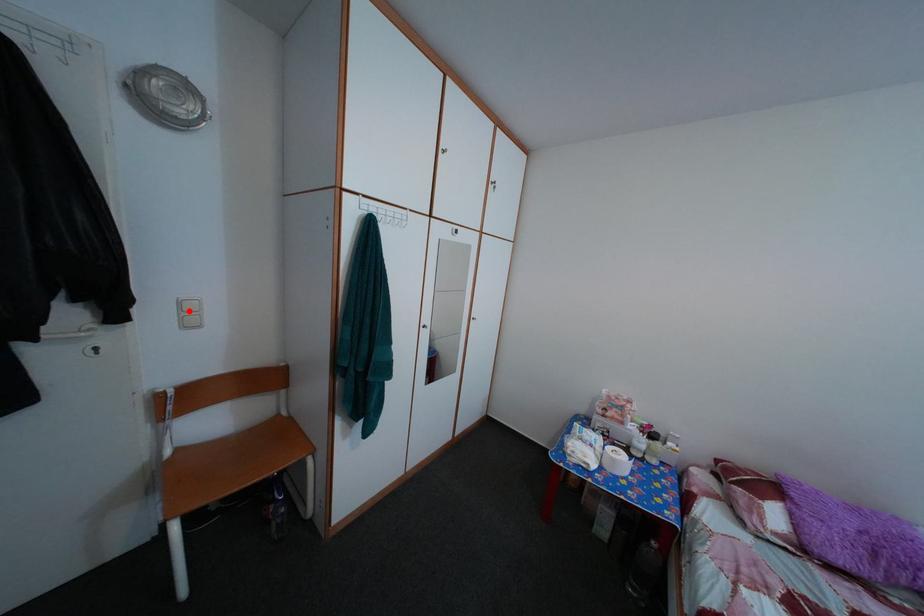
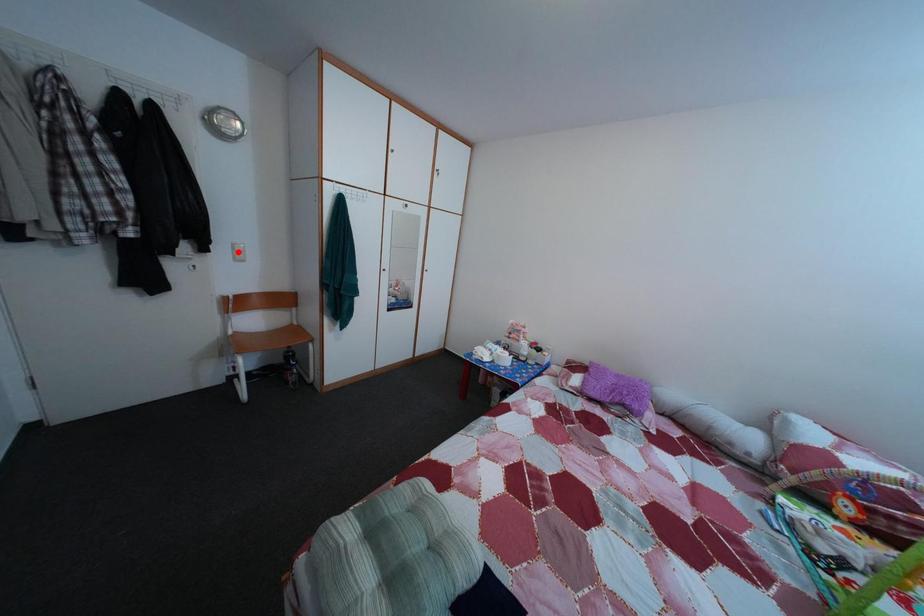
I am providing you with two images of the same scene from different viewpoints. A red point is marked on the first image and another point is marked on the second image. Is the red point in image1 aligned with the point shown in image2?

No